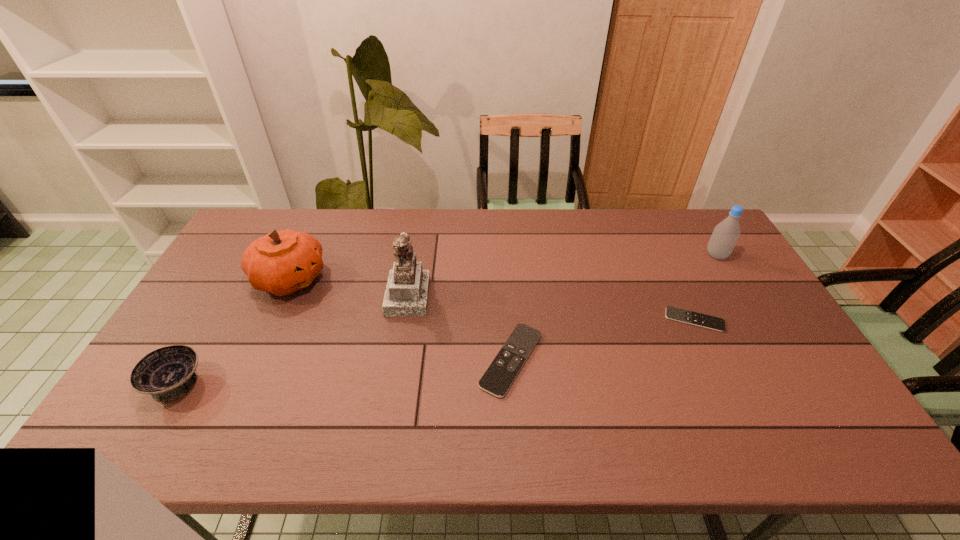
Please point out where to position a new remote control on the left to maintain spacing. Please provide its 2D coordinates. Your answer should be formatted as a tuple, i.e. [(x, y)], where the tuple contains the x and y coordinates of a point satisfying the conditions above.

[(293, 408)]